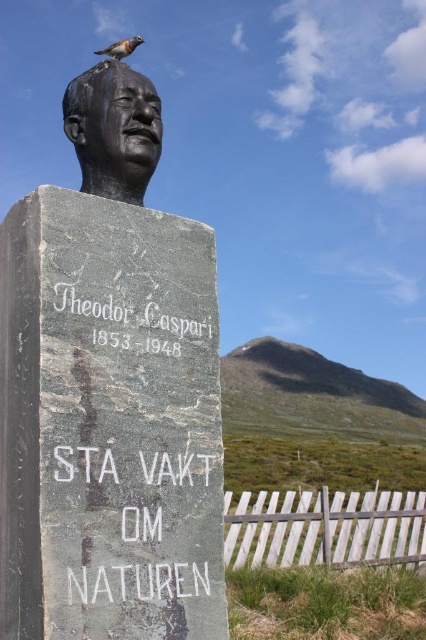
You are standing in front of the monument and want to locate the point with coordinates point (114, 129). Where exactly would this point be located on the monument?

The point (114, 129) is located on the bronze statue at upper center of the monument.

Consider the image. You are standing in front of the monument of Theodor Caspari. There are two points marked on the monument. The first point is at coordinates point (135, 115) and the second point is at point (95, 166). From your perspective, which point is closer to you?

Point (135, 115) is in front of point (95, 166), so it is closer to you.